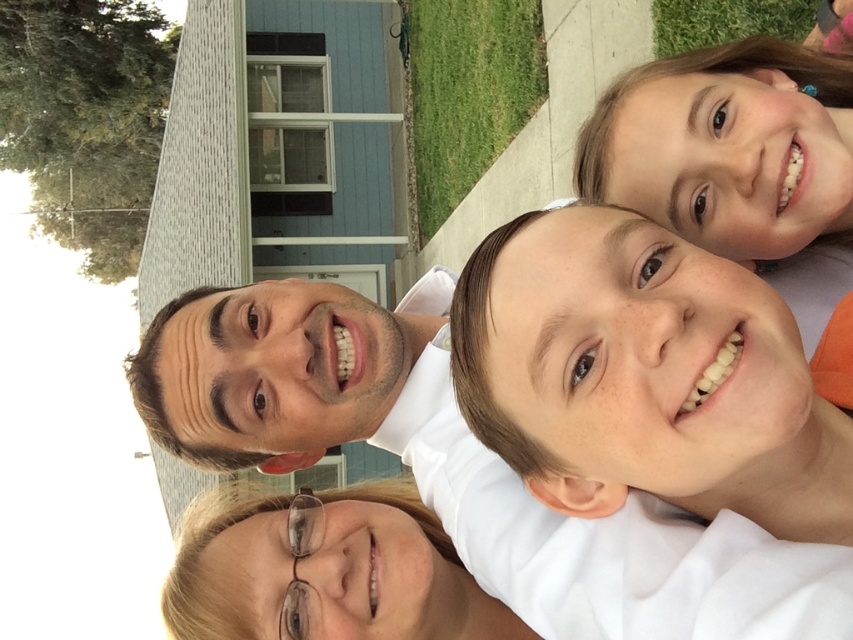
You are a GUI agent. You are given a task and a screenshot of the screen. Output one action in this format:
    pyautogui.click(x=<x>, y=<y>)
    Task: Click on the white smooth shirt at center
    Image resolution: width=853 pixels, height=640 pixels.
    Given the screenshot: What is the action you would take?
    pyautogui.click(x=643, y=376)

Is white smooth shirt at center taller than clear plastic glasses at lower center?

Yes.

Who is more forward, (720, 314) or (259, 605)?

Point (720, 314) is more forward.

Locate an element on the screen. The width and height of the screenshot is (853, 640). white smooth shirt at center is located at coordinates tap(643, 376).

In the scene shown: Is clear plastic glasses at lower center above green grass at lower left?

Actually, clear plastic glasses at lower center is below green grass at lower left.

Is clear plastic glasses at lower center to the right of green grass at lower left from the viewer's perspective?

A: No, clear plastic glasses at lower center is not to the right of green grass at lower left.

Is point (316, 595) closer to viewer compared to point (419, 173)?

Yes, point (316, 595) is in front of point (419, 173).

The height and width of the screenshot is (640, 853). I want to click on clear plastic glasses at lower center, so click(x=323, y=570).

Between point (189, 589) and point (666, 12), which one is positioned behind?

The point (666, 12) is behind.

Which is above, clear plastic glasses at lower center or green grass at upper center?

green grass at upper center is higher up.

Image resolution: width=853 pixels, height=640 pixels. Identify the location of clear plastic glasses at lower center. (323, 570).

Where is `clear plastic glasses at lower center`? The height and width of the screenshot is (640, 853). clear plastic glasses at lower center is located at coordinates (323, 570).